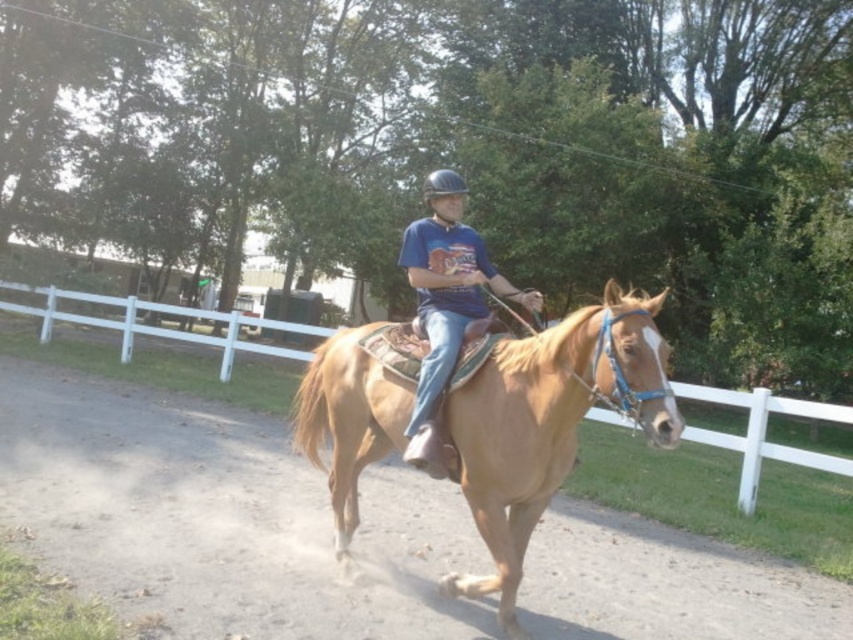
Question: Among these objects, which one is farthest from the camera?

Choices:
 (A) black hard helmet at center
 (B) dusty brown dirt track at center

Answer: (B)

Question: Is white wooden fence at center thinner than blue cotton shirt at center?

Choices:
 (A) no
 (B) yes

Answer: (A)

Question: Does white wooden fence at center have a lesser width compared to blue cotton shirt at center?

Choices:
 (A) no
 (B) yes

Answer: (A)

Question: Which object appears farthest from the camera in this image?

Choices:
 (A) black hard helmet at center
 (B) dusty brown dirt track at center
 (C) blue cotton shirt at center

Answer: (B)

Question: In this image, where is white wooden fence at center located relative to blue cotton shirt at center?

Choices:
 (A) above
 (B) below

Answer: (B)

Question: Which object is closer to the camera taking this photo?

Choices:
 (A) blue cotton shirt at center
 (B) white wooden fence at center
 (C) black hard helmet at center
 (D) light brown leather horse at center

Answer: (D)